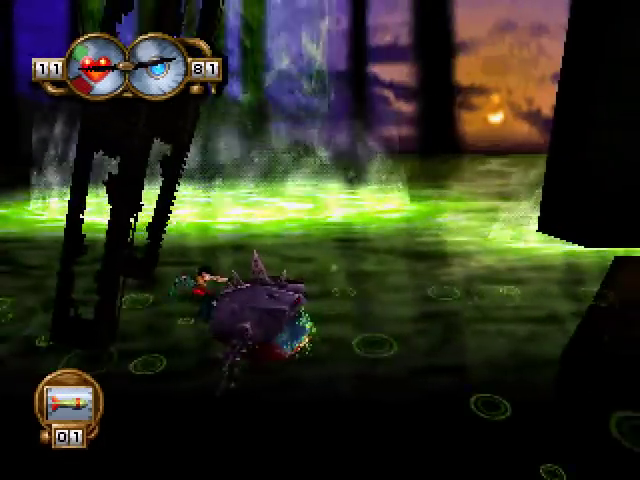
You are a GUI agent. You are given a task and a screenshot of the screen. Output one action in this format:
    pyautogui.click(x=<x>, y=<y>)
    Task: Click on the neon green circles on floor
    
    Given the screenshot: What is the action you would take?
    pyautogui.click(x=356, y=348), pyautogui.click(x=157, y=359), pyautogui.click(x=141, y=304), pyautogui.click(x=475, y=404), pyautogui.click(x=545, y=467), pyautogui.click(x=620, y=429), pyautogui.click(x=438, y=294)